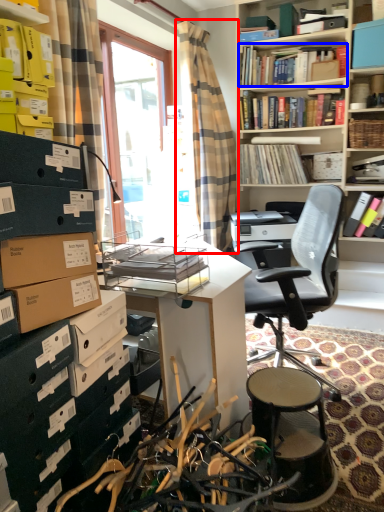
Question: Among these objects, which one is farthest to the camera, curtain (highlighted by a red box) or book (highlighted by a blue box)?

Choices:
 (A) curtain
 (B) book

Answer: (B)